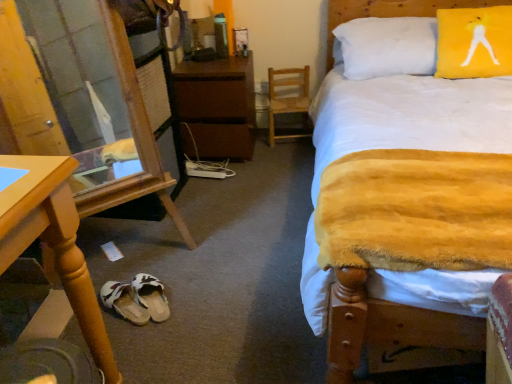
What do you see at coordinates (83, 101) in the screenshot? I see `transparent glass door at lower left` at bounding box center [83, 101].

Measure the distance between point (342, 307) and camera.

Point (342, 307) and camera are 3.33 feet apart from each other.

This screenshot has height=384, width=512. What do you see at coordinates (217, 107) in the screenshot?
I see `brown matte nightstand at center` at bounding box center [217, 107].

The image size is (512, 384). In order to click on wooden swivel chair at center in this screenshot , I will do `click(287, 98)`.

Which point is more distant from viewer, (338, 356) or (243, 102)?

Positioned behind is point (243, 102).

Is the position of yellow plush blanket at center less distant than that of brown matte nightstand at center?

Yes, the depth of yellow plush blanket at center is less than that of brown matte nightstand at center.

From the image's perspective, is yellow plush blanket at center located above brown matte nightstand at center?

No, from the image's perspective, yellow plush blanket at center is not on top of brown matte nightstand at center.

Is point (160, 310) farther from viewer compared to point (269, 117)?

No, (160, 310) is in front of (269, 117).

Can you confirm if white fabric sandals at lower center, placed as the first footwear when sorted from left to right, is taller than wooden swivel chair at center?

Incorrect, the height of white fabric sandals at lower center, placed as the first footwear when sorted from left to right, is not larger of that of wooden swivel chair at center.

Which object is wider, white fabric sandals at lower center, placed as the first footwear when sorted from left to right, or wooden swivel chair at center?

wooden swivel chair at center is wider.

You are a GUI agent. You are given a task and a screenshot of the screen. Output one action in this format:
    pyautogui.click(x=<x>, y=<y>)
    Task: Click on the 2nd footwear counting from the left of the wooden swivel chair at center
    This screenshot has width=512, height=384.
    Given the screenshot: What is the action you would take?
    pyautogui.click(x=137, y=299)

From the image's perspective, does yellow fabric pillow at upper right appear higher than brown matte nightstand at center?

Yes.

Looking at this image, between yellow fabric pillow at upper right and brown matte nightstand at center, which one appears on the right side from the viewer's perspective?

yellow fabric pillow at upper right.

Are yellow fabric pillow at upper right and brown matte nightstand at center located far from each other?

yellow fabric pillow at upper right is far away from brown matte nightstand at center.

Between point (250, 146) and point (461, 21), which one is positioned in front?

Positioned in front is point (461, 21).

Considering the positions of objects brown matte nightstand at center and yellow fabric pillow at upper right in the image provided, who is behind, brown matte nightstand at center or yellow fabric pillow at upper right?

brown matte nightstand at center is further away from the camera.

Is brown matte nightstand at center aimed at yellow fabric pillow at upper right?

No.

In the image, is white fabric sandals at lower center, placed as the second footwear when sorted from right to left, on the left side or the right side of yellow plush blanket at center?

In the image, white fabric sandals at lower center, placed as the second footwear when sorted from right to left, appears on the left side of yellow plush blanket at center.

Choose the correct answer: Is white fabric sandals at lower center, placed as the second footwear when sorted from right to left, inside yellow plush blanket at center or outside it?

white fabric sandals at lower center, placed as the second footwear when sorted from right to left, exists outside the volume of yellow plush blanket at center.

Is white fabric sandals at lower center, placed as the second footwear when sorted from right to left, taller or shorter than yellow plush blanket at center?

white fabric sandals at lower center, placed as the second footwear when sorted from right to left, is shorter than yellow plush blanket at center.

From a real-world perspective, does white fabric sandals at lower center, placed as the second footwear when sorted from right to left, stand above yellow plush blanket at center?

No, from a real-world perspective, white fabric sandals at lower center, placed as the second footwear when sorted from right to left, is not over yellow plush blanket at center

Is white fabric sandals at lower center, placed as the first footwear when sorted from left to right, bigger than brown matte nightstand at center?

No.

Is white fabric sandals at lower center, placed as the second footwear when sorted from right to left, shorter than brown matte nightstand at center?

Yes.

From the image's perspective, who appears lower, white fabric sandals at lower center, placed as the second footwear when sorted from right to left, or brown matte nightstand at center?

white fabric sandals at lower center, placed as the second footwear when sorted from right to left.

Is white fabric slipper at lower center, the 2th footwear in the left-to-right sequence, turned away from yellow fabric pillow at upper right?

Result: No, white fabric slipper at lower center, the 2th footwear in the left-to-right sequence, is not facing the opposite direction of yellow fabric pillow at upper right.

From a real-world perspective, is white fabric slipper at lower center, which appears as the first footwear when viewed from the right, on yellow fabric pillow at upper right?

Incorrect, from a real-world perspective, white fabric slipper at lower center, which appears as the first footwear when viewed from the right, is lower than yellow fabric pillow at upper right.

Where is `the 1st footwear below the yellow fabric pillow at upper right (from the image's perspective)`? the 1st footwear below the yellow fabric pillow at upper right (from the image's perspective) is located at coordinates (151, 296).

Considering the positions of objects white fabric slipper at lower center, which appears as the first footwear when viewed from the right, and yellow fabric pillow at upper right in the image provided, who is more to the right, white fabric slipper at lower center, which appears as the first footwear when viewed from the right, or yellow fabric pillow at upper right?

yellow fabric pillow at upper right.

Identify the location of nightstand that is under the yellow plush blanket at center (from a real-world perspective). The width and height of the screenshot is (512, 384). (217, 107).

Locate an element on the screen. This screenshot has width=512, height=384. swivel chair above the white fabric sandals at lower center, placed as the first footwear when sorted from left to right (from a real-world perspective) is located at coordinates (287, 98).

Based on their spatial positions, is yellow fabric pillow at upper right or wooden swivel chair at center further from wooden desk at lower left?

yellow fabric pillow at upper right is positioned further to the anchor wooden desk at lower left.

Based on their spatial positions, is yellow fabric pillow at upper right or transparent glass door at lower left closer to wooden desk at lower left?

The object closer to wooden desk at lower left is transparent glass door at lower left.

Based on their spatial positions, is brown matte nightstand at center or white fabric sandals at lower center, placed as the first footwear when sorted from left to right, closer to wooden desk at lower left?

white fabric sandals at lower center, placed as the first footwear when sorted from left to right, is closer to wooden desk at lower left.

Based on their spatial positions, is wooden desk at lower left or brown matte nightstand at center further from white fabric slipper at lower center, which appears as the first footwear when viewed from the right?

brown matte nightstand at center is positioned further to the anchor white fabric slipper at lower center, which appears as the first footwear when viewed from the right.

Based on their spatial positions, is wooden desk at lower left or yellow plush blanket at center further from white fabric sandals at lower center, placed as the second footwear when sorted from right to left?

The object further to white fabric sandals at lower center, placed as the second footwear when sorted from right to left, is yellow plush blanket at center.

Which object lies nearer to the anchor point wooden swivel chair at center, yellow fabric pillow at upper right or white fabric sandals at lower center, placed as the first footwear when sorted from left to right?

yellow fabric pillow at upper right is positioned closer to the anchor wooden swivel chair at center.

Based on their spatial positions, is wooden swivel chair at center or transparent glass door at lower left closer to yellow fabric pillow at upper right?

wooden swivel chair at center is positioned closer to the anchor yellow fabric pillow at upper right.

Estimate the real-world distances between objects in this image. Which object is further from yellow fabric pillow at upper right, white fabric slipper at lower center, which appears as the first footwear when viewed from the right, or brown matte nightstand at center?

Based on the image, white fabric slipper at lower center, which appears as the first footwear when viewed from the right, appears to be further to yellow fabric pillow at upper right.

This screenshot has width=512, height=384. Identify the location of footwear between brown matte nightstand at center and white fabric sandals at lower center, placed as the first footwear when sorted from left to right, in the vertical direction. pos(151,296).

This screenshot has height=384, width=512. I want to click on swivel chair located between white fabric sandals at lower center, placed as the first footwear when sorted from left to right, and yellow fabric pillow at upper right in the left-right direction, so click(x=287, y=98).

Find the location of `nightstand located between transparent glass door at lower left and yellow fabric pillow at upper right in the left-right direction`. nightstand located between transparent glass door at lower left and yellow fabric pillow at upper right in the left-right direction is located at coordinates (217, 107).

I want to click on bed located between transparent glass door at lower left and yellow fabric pillow at upper right in the left-right direction, so click(x=389, y=327).